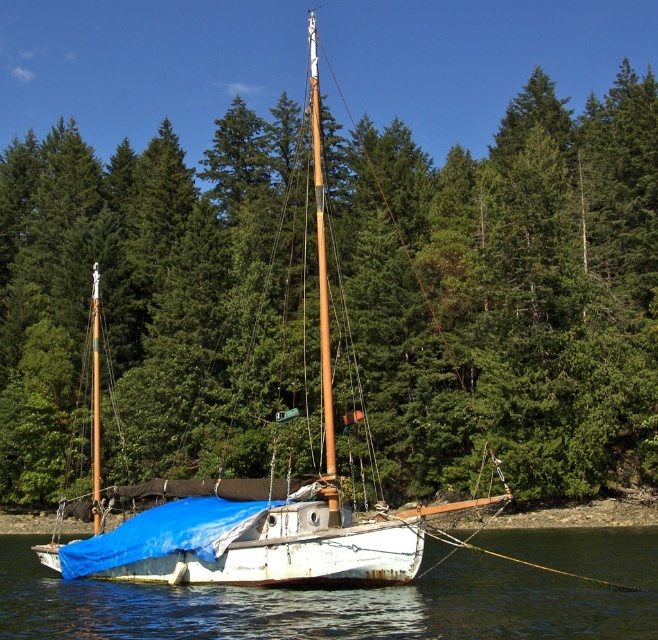
Question: Is white matte water at center further to the viewer compared to white tarpaulin sailboat at center?

Choices:
 (A) no
 (B) yes

Answer: (A)

Question: Observing the image, what is the correct spatial positioning of white matte water at center in reference to white tarpaulin sailboat at center?

Choices:
 (A) above
 (B) below

Answer: (B)

Question: Among these objects, which one is farthest from the camera?

Choices:
 (A) white tarpaulin sailboat at center
 (B) white matte water at center

Answer: (A)

Question: Which point appears closest to the camera in this image?

Choices:
 (A) (107, 579)
 (B) (86, 596)

Answer: (B)

Question: Is white matte water at center to the right of white tarpaulin sailboat at center from the viewer's perspective?

Choices:
 (A) yes
 (B) no

Answer: (A)